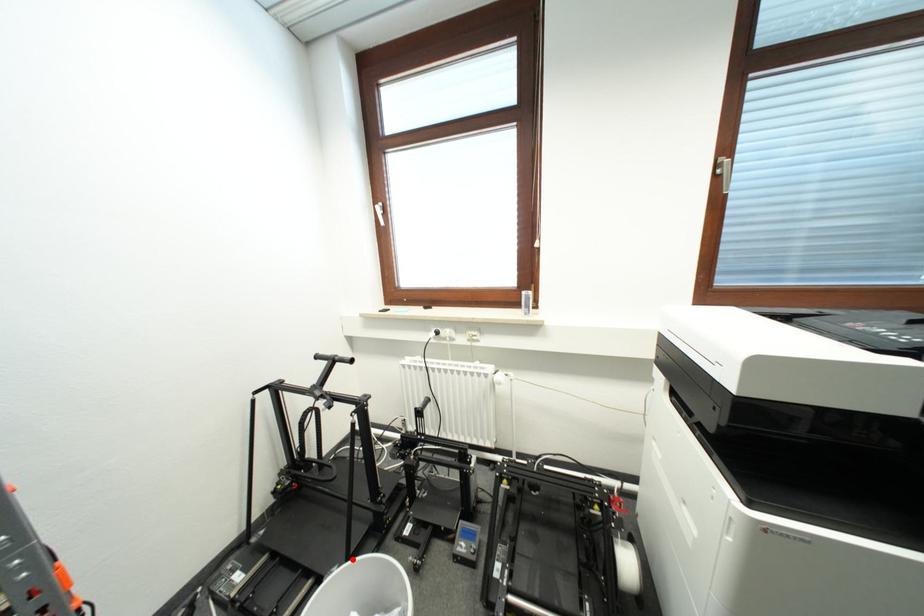
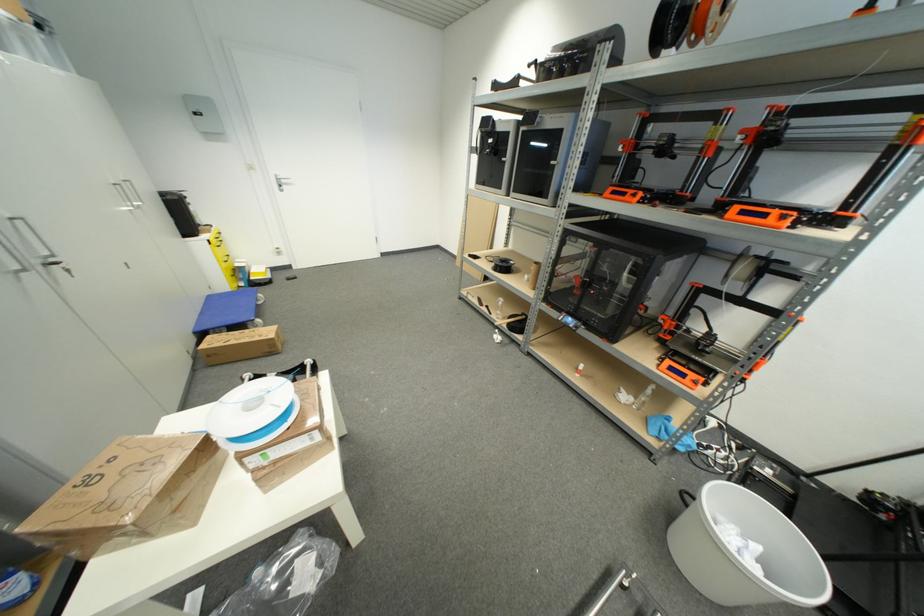
Question: I am providing you with two images of the same scene from different viewpoints. In image1, a red point is highlighted. Considering the same 3D point in image2, which of the following is correct?

Choices:
 (A) It is closer
 (B) It is farther

Answer: (B)